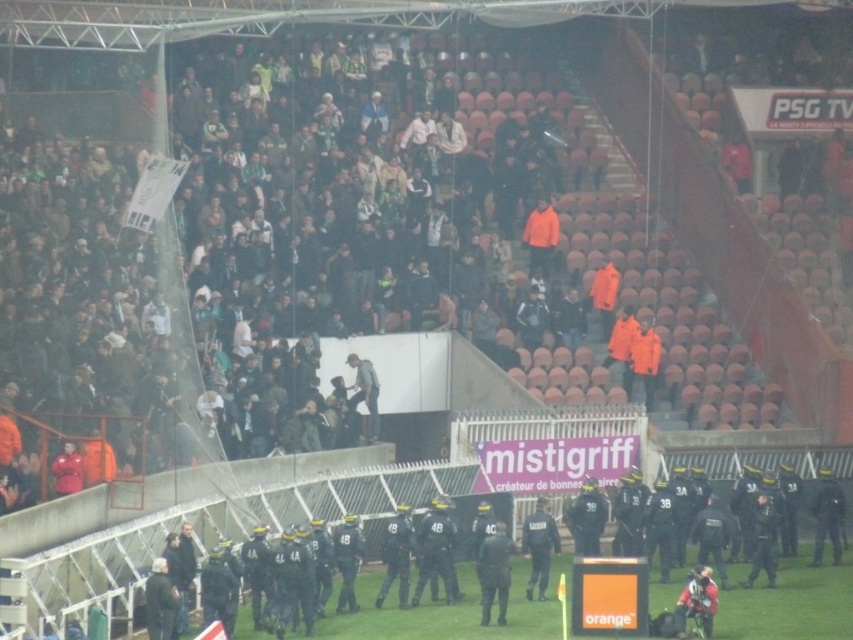
You are a photographer standing at the edge of the field. You want to take a photo of the black matte uniform at center and the black uniformed officer at center. Which one will appear larger in your photo?

The black matte uniform at center will appear larger in the photo because it is closer to the viewer than the black uniformed officer at center.

You are a drone operator tasked with capturing aerial footage of the sports stadium scene. Your camera is currently positioned at point (494, 572). What object is directly beneath your camera at this coordinate?

The dark green uniform at center is located at point (494, 572), so the object directly beneath your camera is the dark green uniform at center.